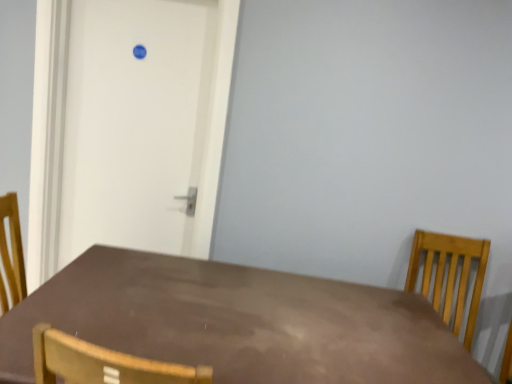
Question: Does light brown wooden chair at right have a greater width compared to brown matte table at center?

Choices:
 (A) no
 (B) yes

Answer: (A)

Question: Is light brown wooden chair at right to the right of brown matte table at center from the viewer's perspective?

Choices:
 (A) no
 (B) yes

Answer: (B)

Question: Considering the relative sizes of light brown wooden chair at right and brown matte table at center in the image provided, is light brown wooden chair at right smaller than brown matte table at center?

Choices:
 (A) yes
 (B) no

Answer: (A)

Question: From the image's perspective, would you say light brown wooden chair at right is shown under brown matte table at center?

Choices:
 (A) no
 (B) yes

Answer: (A)

Question: From a real-world perspective, is light brown wooden chair at right located beneath brown matte table at center?

Choices:
 (A) no
 (B) yes

Answer: (A)

Question: Is brown matte table at center bigger or smaller than white matte door at upper left?

Choices:
 (A) big
 (B) small

Answer: (A)

Question: Considering the positions of point (361, 345) and point (166, 69), is point (361, 345) closer or farther from the camera than point (166, 69)?

Choices:
 (A) farther
 (B) closer

Answer: (B)

Question: In the image, is brown matte table at center on the left side or the right side of white matte door at upper left?

Choices:
 (A) left
 (B) right

Answer: (B)

Question: From a real-world perspective, is brown matte table at center physically located above or below white matte door at upper left?

Choices:
 (A) below
 (B) above

Answer: (A)

Question: Would you say brown matte table at center is inside or outside light brown wooden chair at right?

Choices:
 (A) outside
 (B) inside

Answer: (A)

Question: Relative to light brown wooden chair at right, is brown matte table at center in front or behind?

Choices:
 (A) behind
 (B) front

Answer: (B)

Question: From their relative heights in the image, would you say brown matte table at center is taller or shorter than light brown wooden chair at right?

Choices:
 (A) short
 (B) tall

Answer: (B)

Question: From a real-world perspective, is brown matte table at center physically located above or below light brown wooden chair at right?

Choices:
 (A) below
 (B) above

Answer: (A)

Question: In terms of width, does light brown wooden chair at right look wider or thinner when compared to brown matte table at center?

Choices:
 (A) wide
 (B) thin

Answer: (B)

Question: From the image's perspective, is light brown wooden chair at right positioned above or below brown matte table at center?

Choices:
 (A) below
 (B) above

Answer: (B)